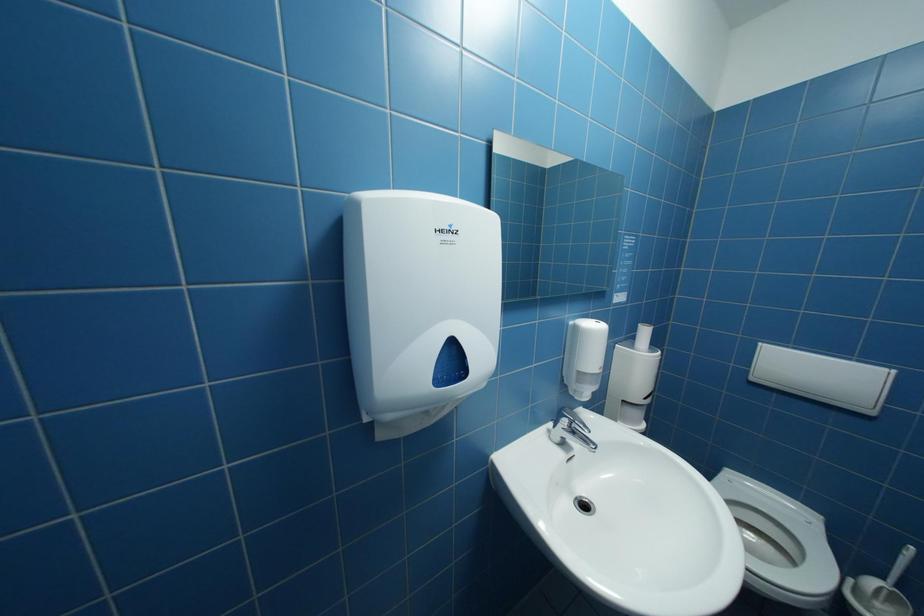
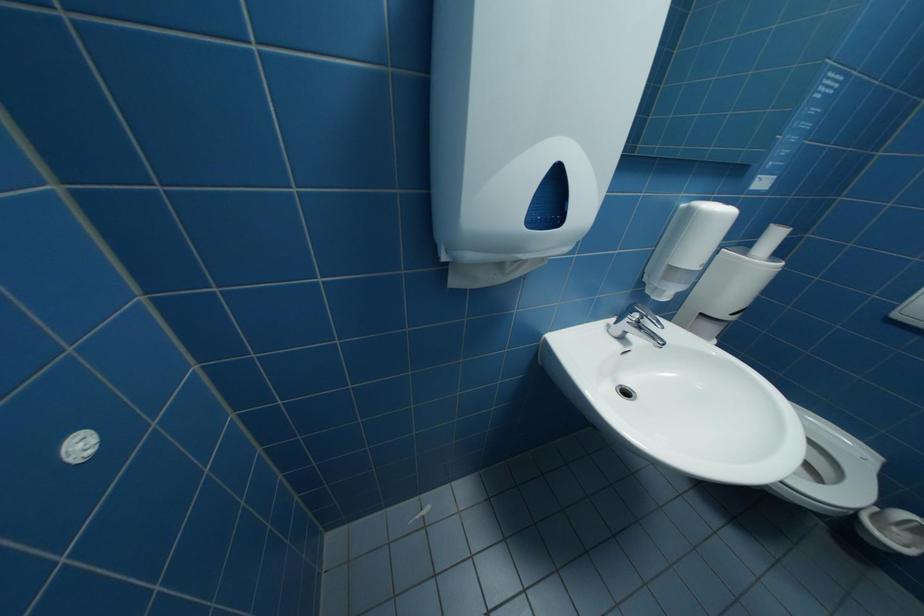
In a continuous first-person perspective shot, in which direction is the camera moving?

The cameraman walked toward left, forward.